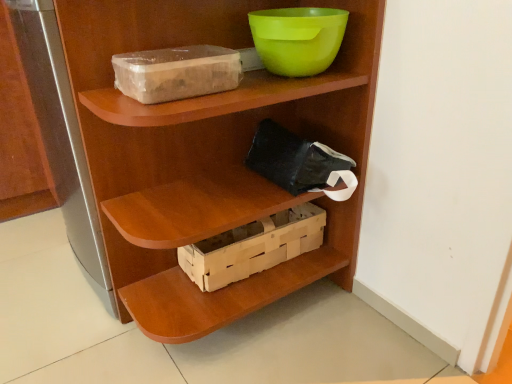
What is the approximate height of green plastic bowl at upper center?

green plastic bowl at upper center is 4.75 inches tall.

What do you see at coordinates (298, 39) in the screenshot? The width and height of the screenshot is (512, 384). I see `green plastic bowl at upper center` at bounding box center [298, 39].

Image resolution: width=512 pixels, height=384 pixels. Describe the element at coordinates (209, 154) in the screenshot. I see `wooden shelf at center` at that location.

Describe the element at coordinates (176, 72) in the screenshot. The width and height of the screenshot is (512, 384). I see `transparent plastic storage box at upper left` at that location.

Locate an element on the screen. This screenshot has height=384, width=512. green plastic bowl at upper center is located at coordinates 298,39.

Who is bigger, wooden shelf at center or green plastic bowl at upper center?

With larger size is wooden shelf at center.

Considering the relative sizes of wooden shelf at center and green plastic bowl at upper center in the image provided, is wooden shelf at center wider than green plastic bowl at upper center?

Indeed, wooden shelf at center has a greater width compared to green plastic bowl at upper center.

From the picture: Is wooden shelf at center oriented towards green plastic bowl at upper center?

No, wooden shelf at center is not oriented towards green plastic bowl at upper center.

Is transparent plastic storage box at upper left not near wooden crate at center?

No, transparent plastic storage box at upper left is in close proximity to wooden crate at center.

In the scene shown: Between transparent plastic storage box at upper left and wooden crate at center, which one has less height?

transparent plastic storage box at upper left is shorter.

Would you say transparent plastic storage box at upper left is inside or outside wooden crate at center?

transparent plastic storage box at upper left is not enclosed by wooden crate at center.

Is wooden crate at center at the back of transparent plastic storage box at upper left?

That's not correct — transparent plastic storage box at upper left is not looking away from wooden crate at center.

From the image's perspective, is green plastic bowl at upper center above wooden shelf at center?

Yes, from the image's perspective, green plastic bowl at upper center is over wooden shelf at center.

Considering the sizes of objects green plastic bowl at upper center and wooden shelf at center in the image provided, who is shorter, green plastic bowl at upper center or wooden shelf at center?

green plastic bowl at upper center is shorter.

Looking at this image, is green plastic bowl at upper center next to wooden shelf at center?

No, green plastic bowl at upper center is not touching wooden shelf at center.

Based on the photo, is green plastic bowl at upper center at the right side of wooden shelf at center?

Yes, green plastic bowl at upper center is to the right of wooden shelf at center.

What's the angular difference between wooden shelf at center and transparent plastic storage box at upper left's facing directions?

The angle between the facing direction of wooden shelf at center and the facing direction of transparent plastic storage box at upper left is 89.7 degrees.

Between wooden shelf at center and transparent plastic storage box at upper left, which one has larger size?

wooden shelf at center.

Which is farther from the camera, [102,39] or [234,79]?

Point [234,79]

Which is correct: wooden shelf at center is inside transparent plastic storage box at upper left, or outside of it?

wooden shelf at center is located beyond the bounds of transparent plastic storage box at upper left.

You are a GUI agent. You are given a task and a screenshot of the screen. Output one action in this format:
    pyautogui.click(x=<x>, y=<y>)
    Task: Click on the box lying on the left of green plastic bowl at upper center
    
    Given the screenshot: What is the action you would take?
    pyautogui.click(x=253, y=247)

From a real-world perspective, is wooden crate at center physically below green plastic bowl at upper center?

Yes, from a real-world perspective, wooden crate at center is below green plastic bowl at upper center.

Is green plastic bowl at upper center a part of wooden crate at center?

No, green plastic bowl at upper center is located outside of wooden crate at center.

Does wooden crate at center lie behind green plastic bowl at upper center?

That is True.

Would you consider wooden shelf at center to be distant from wooden crate at center?

That's not correct — wooden shelf at center is a little close to wooden crate at center.

Considering the positions of objects wooden shelf at center and wooden crate at center in the image provided, who is more to the left, wooden shelf at center or wooden crate at center?

wooden shelf at center is more to the left.

Where is `box on the right side of wooden shelf at center`? This screenshot has height=384, width=512. box on the right side of wooden shelf at center is located at coordinates (253, 247).

This screenshot has height=384, width=512. Identify the location of storage box on the left of wooden shelf at center. (176, 72).

Is transparent plastic storage box at upper left closer to the viewer compared to wooden shelf at center?

No.

Is transparent plastic storage box at upper left to the left or to the right of wooden shelf at center in the image?

From the image, it's evident that transparent plastic storage box at upper left is to the left of wooden shelf at center.

Is transparent plastic storage box at upper left bigger or smaller than wooden shelf at center?

Considering their sizes, transparent plastic storage box at upper left takes up less space than wooden shelf at center.

The height and width of the screenshot is (384, 512). Find the location of `shelf in front of the green plastic bowl at upper center`. shelf in front of the green plastic bowl at upper center is located at coordinates (209, 154).

Locate an element on the screen. box behind the transparent plastic storage box at upper left is located at coordinates (253, 247).

Considering their positions, is transparent plastic storage box at upper left positioned closer to wooden shelf at center than wooden crate at center?

Among the two, wooden crate at center is located nearer to wooden shelf at center.

Considering their positions, is wooden crate at center positioned further to wooden shelf at center than transparent plastic storage box at upper left?

The object further to wooden shelf at center is transparent plastic storage box at upper left.

Estimate the real-world distances between objects in this image. Which object is closer to green plastic bowl at upper center, wooden shelf at center or transparent plastic storage box at upper left?

Among the two, transparent plastic storage box at upper left is located nearer to green plastic bowl at upper center.

Estimate the real-world distances between objects in this image. Which object is closer to wooden crate at center, transparent plastic storage box at upper left or green plastic bowl at upper center?

Based on the image, transparent plastic storage box at upper left appears to be nearer to wooden crate at center.

Which object lies further to the anchor point green plastic bowl at upper center, transparent plastic storage box at upper left or wooden crate at center?

wooden crate at center is further to green plastic bowl at upper center.

Considering their positions, is green plastic bowl at upper center positioned further to wooden crate at center than wooden shelf at center?

The object further to wooden crate at center is green plastic bowl at upper center.

From the picture: Based on their spatial positions, is green plastic bowl at upper center or wooden crate at center closer to transparent plastic storage box at upper left?

green plastic bowl at upper center lies closer to transparent plastic storage box at upper left than the other object.

Considering their positions, is green plastic bowl at upper center positioned closer to wooden shelf at center than wooden crate at center?

Among the two, wooden crate at center is located nearer to wooden shelf at center.

Identify the location of shelf between green plastic bowl at upper center and wooden crate at center in the up-down direction. The width and height of the screenshot is (512, 384). (209, 154).

Locate an element on the screen. storage box between wooden shelf at center and wooden crate at center in the front-back direction is located at coordinates (176, 72).

At what (x,y) coordinates should I click in order to perform the action: click on storage box between green plastic bowl at upper center and wooden shelf at center from top to bottom. Please return your answer as a coordinate pair (x, y). This screenshot has width=512, height=384. Looking at the image, I should click on (176, 72).

I want to click on storage box that lies between green plastic bowl at upper center and wooden crate at center from top to bottom, so click(x=176, y=72).